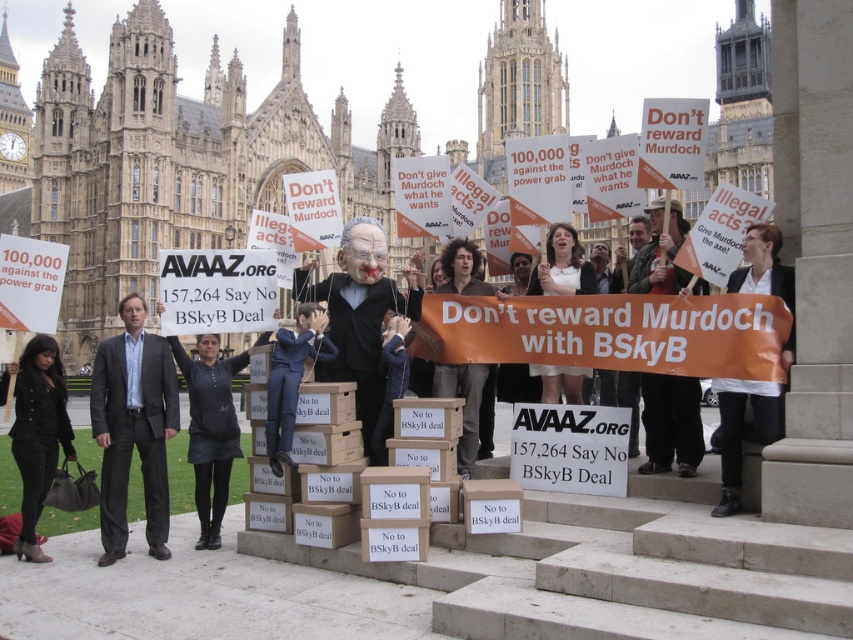
You are a photographer trying to capture both the orange paper sign at center and the white fabric sign at center in a single frame. Considering their sizes, which sign might block the view of the other when positioned closer to the camera?

The orange paper sign at center has a greater height compared to the white fabric sign at center. Since it is taller, if positioned closer to the camera, it could potentially block the view of the white fabric sign at center.

You are a photographer standing at the front of the protest scene. You want to capture both the orange paper sign at center and the white fabric sign at center in a single photo. Given that your camera has a maximum focus range of 4 meters, will you be able to include both signs in the photo without moving your position?

The orange paper sign at center and white fabric sign at center are 3.96 meters apart from each other. Since the distance between them is within the camera maximum focus range of 4 meters, you can include both signs in the photo without moving your position.

You are a photographer at the protest scene. You want to take a photo that includes both the black leather jacket at center and the matte blue suit at center. Which of the two objects should you focus on first to ensure both are in frame, given their sizes?

→ The black leather jacket at center is larger than the matte blue suit at center, so you should focus on the black leather jacket at center first to ensure both are in frame.